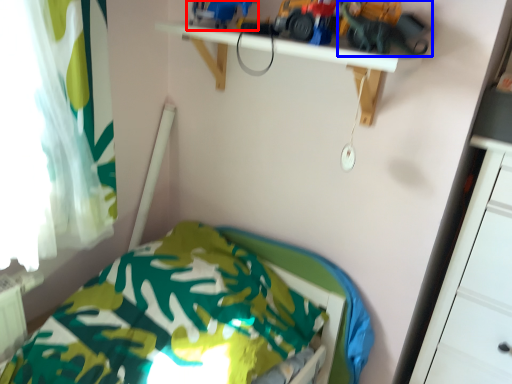
Question: Among these objects, which one is farthest to the camera, toy (highlighted by a red box) or toy car (highlighted by a blue box)?

Choices:
 (A) toy
 (B) toy car

Answer: (A)